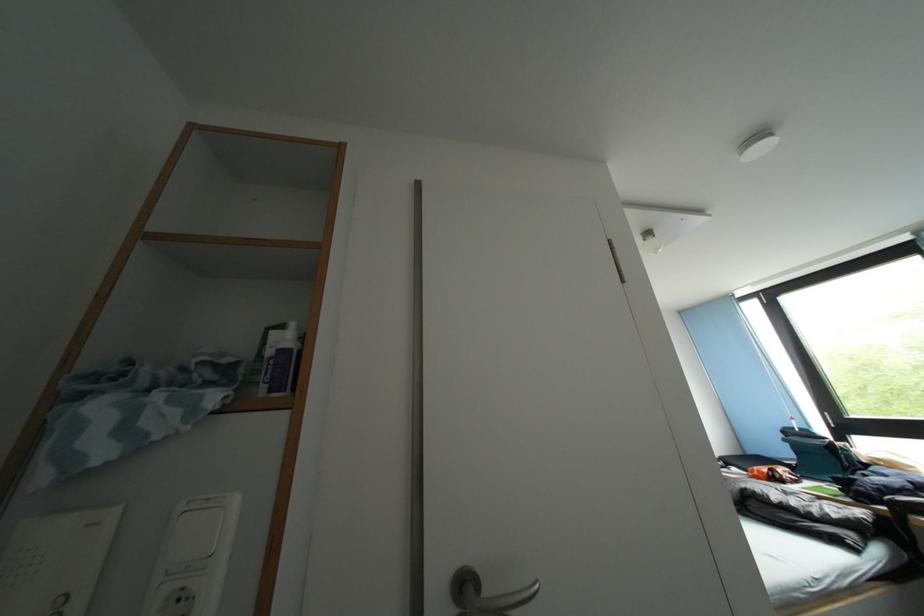
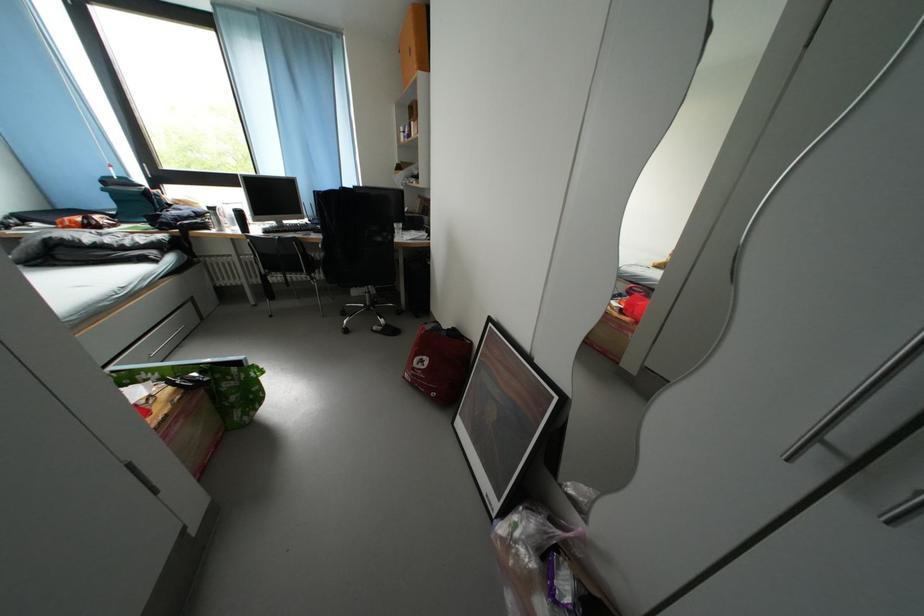
First-person continuous shooting, in which direction is the camera rotating?

The camera's rotation is toward right-down.